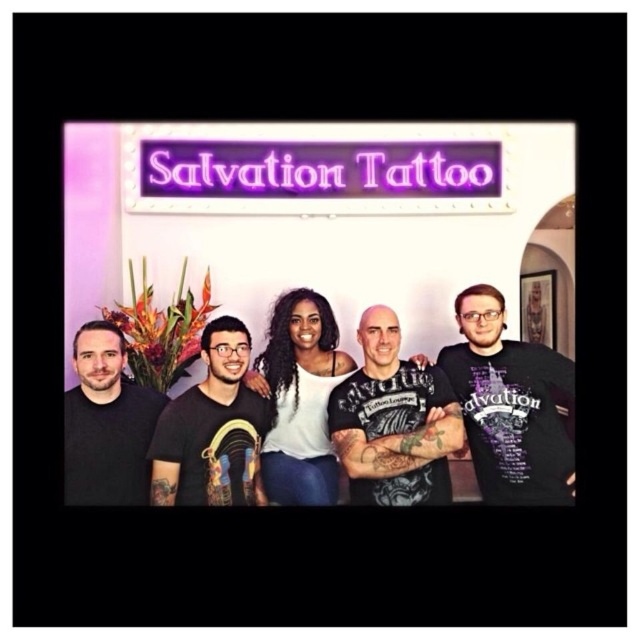
Question: Which is nearer to the white matte shirt at center?

Choices:
 (A) matte black t-shirt at left
 (B) black matte t-shirt at right
 (C) black matte t-shirt at center
 (D) black t-shirt at center

Answer: (C)

Question: Does black matte t-shirt at right have a lesser width compared to black matte t-shirt at center?

Choices:
 (A) yes
 (B) no

Answer: (B)

Question: Which of the following is the closest to the observer?

Choices:
 (A) (115, 374)
 (B) (516, 352)

Answer: (A)

Question: Can you confirm if black matte t-shirt at right is positioned below white matte shirt at center?

Choices:
 (A) yes
 (B) no

Answer: (B)

Question: Which point appears farthest from the camera in this image?

Choices:
 (A) coord(141,504)
 (B) coord(296,420)
 (C) coord(216,484)
 (D) coord(499,500)

Answer: (B)

Question: Considering the relative positions of black matte t-shirt at center and matte black t-shirt at left in the image provided, where is black matte t-shirt at center located with respect to matte black t-shirt at left?

Choices:
 (A) left
 (B) right

Answer: (B)